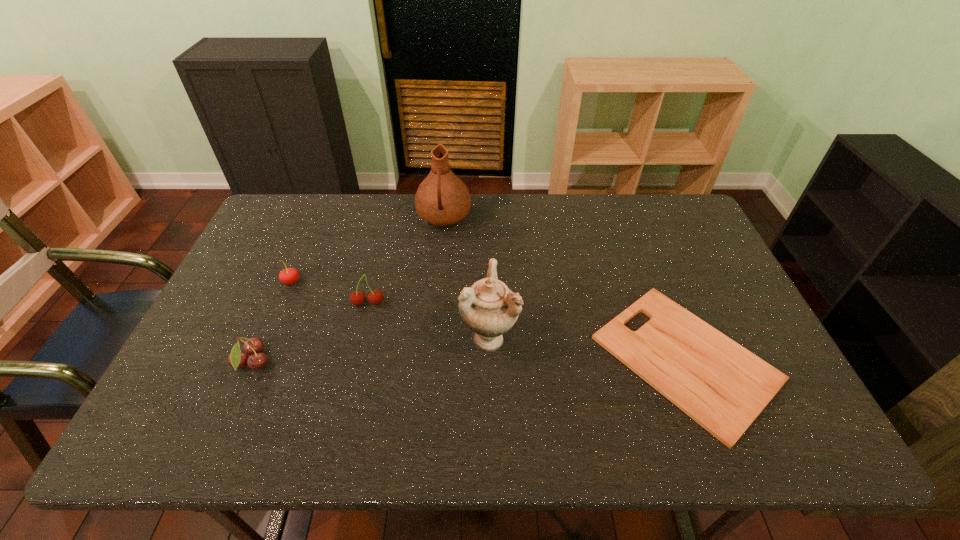
Where is `vacant space that satisfies the following two spatial constraints: 1. on the surface of the chopping board; 2. on the left side of the third object from left to right`? vacant space that satisfies the following two spatial constraints: 1. on the surface of the chopping board; 2. on the left side of the third object from left to right is located at coordinates (355, 359).

Where is `free space that satisfies the following two spatial constraints: 1. on the surface of the third object from left to right; 2. on the left side of the urn`? Image resolution: width=960 pixels, height=540 pixels. free space that satisfies the following two spatial constraints: 1. on the surface of the third object from left to right; 2. on the left side of the urn is located at coordinates (360, 338).

Find the location of a particular element. vacant region that satisfies the following two spatial constraints: 1. on the surface of the rightmost cherry; 2. on the right side of the urn is located at coordinates (360, 338).